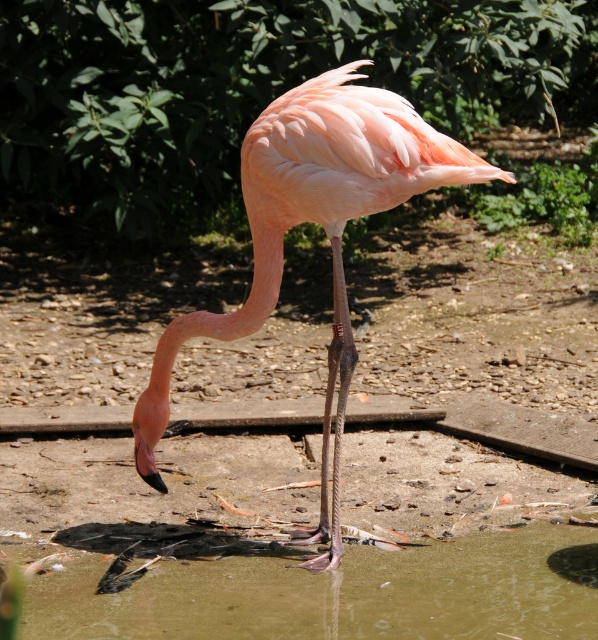
You are a zookeeper who wants to ensure the flamingo has enough space to move around. Based on the image, is the greenish water at lower center wider than the pink matte flamingo at center?

The greenish water at lower center is wider than the pink matte flamingo at center according to the description.

You are a zookeeper observing the flamingo enclosure. You notice the greenish water at lower center and the pink matte flamingo at center. Which object is located more to the right side of the enclosure?

The greenish water at lower center is positioned on the right side of the pink matte flamingo at center, so the greenish water at lower center is more to the right side of the enclosure.

You are a zookeeper observing the flamingo enclosure. You notice the greenish water at lower center and the pink matte flamingo at center. Which object is taller in the image?

The pink matte flamingo at center is taller than the greenish water at lower center.